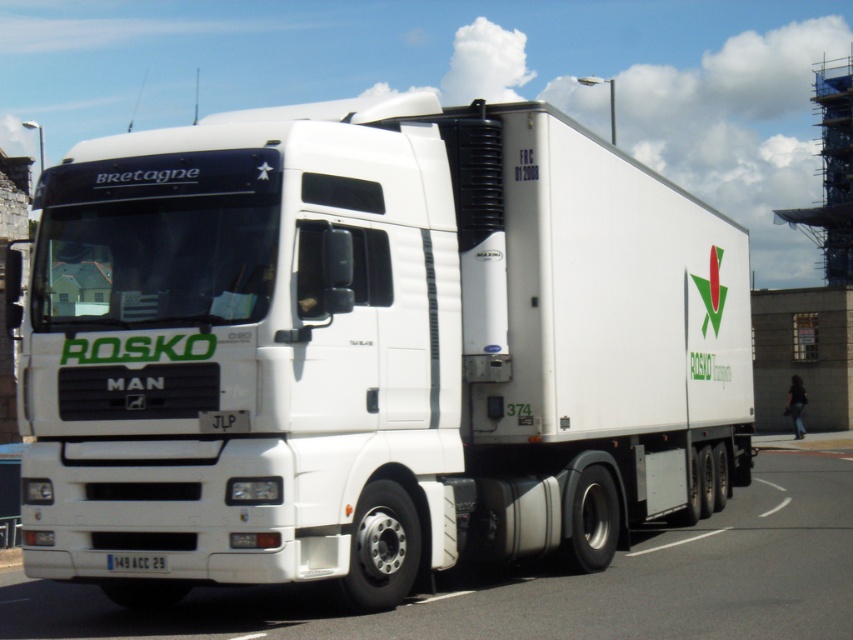
Based on the photo, you are standing on the sidewalk and see the white matte truck at center and the white glossy truck at center. Which truck is positioned to the left?

The white matte truck at center is positioned to the left of the white glossy truck at center.

You are a delivery driver who needs to enter a low clearance tunnel. The tunnel has a height restriction of 4 meters. You are standing next to the white matte truck at center and the white plastic license plate at bottom center. Which object is more likely to hit the tunnel ceiling first?

The white matte truck at center is taller than the white plastic license plate at bottom center, so the white matte truck at center would hit the tunnel ceiling first if it cannot pass under the 4 meter height restriction.